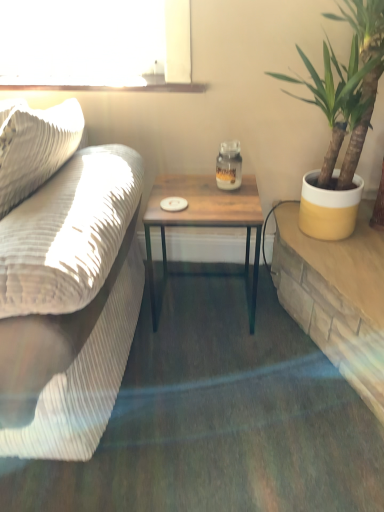
Question: From the image's perspective, relative to clear glass window sill at upper center, is yellow ceramic pot at right above or below?

Choices:
 (A) below
 (B) above

Answer: (A)

Question: Is point (367, 31) closer or farther from the camera than point (182, 88)?

Choices:
 (A) closer
 (B) farther

Answer: (A)

Question: Which is nearer to the clear glass window sill at upper center?

Choices:
 (A) matte glass jar at center
 (B) wooden table at right
 (C) yellow ceramic pot at right
 (D) wooden table at center
 (E) matte beige couch at left

Answer: (A)

Question: Which object is the farthest from the wooden table at right?

Choices:
 (A) yellow ceramic pot at right
 (B) matte glass jar at center
 (C) wooden table at center
 (D) clear glass window sill at upper center
 (E) matte beige couch at left

Answer: (D)